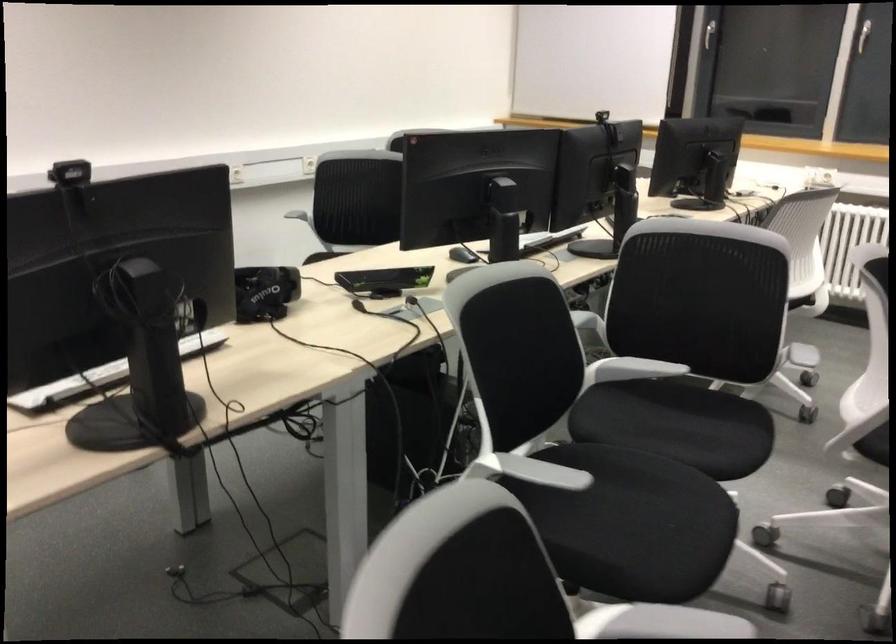
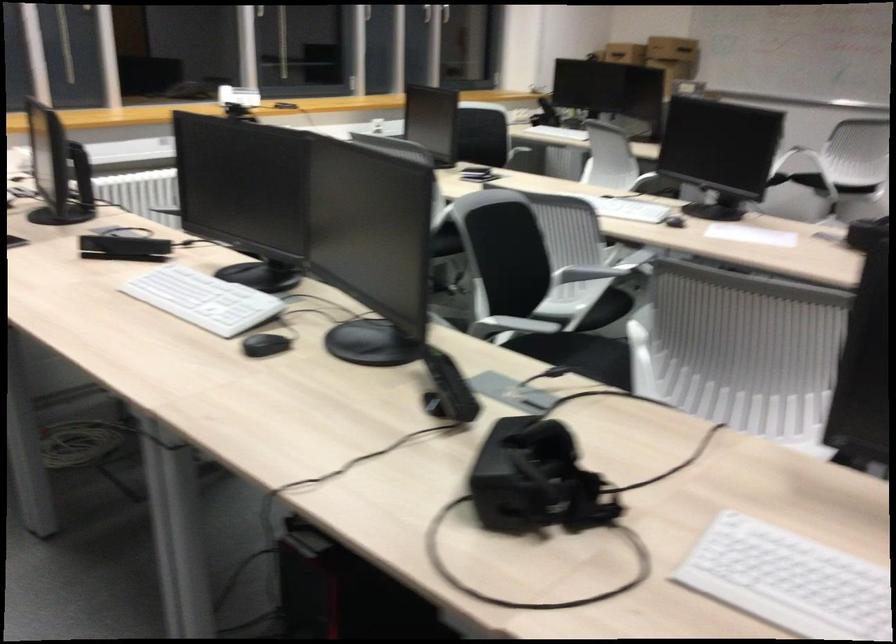
Locate, in the second image, the point that corresponds to the point at 688,410 in the first image.

(579, 355)